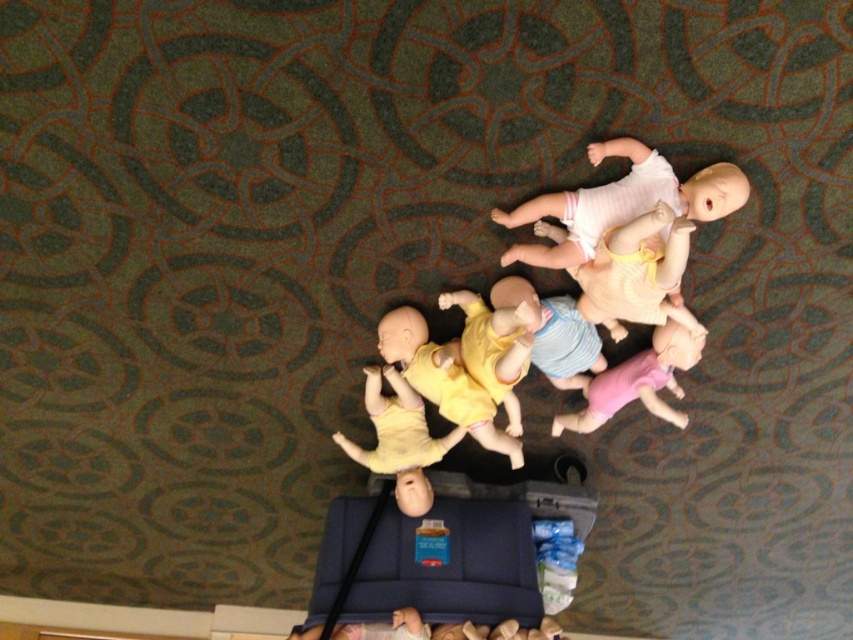
Which is more to the left, matte yellow doll at center or yellow matte baby doll at center?

From the viewer's perspective, matte yellow doll at center appears more on the left side.

Which of these two, matte yellow doll at center or yellow matte baby doll at center, stands shorter?

Standing shorter between the two is yellow matte baby doll at center.

Does point (352, 458) lie behind point (479, 317)?

Yes, point (352, 458) is behind point (479, 317).

The height and width of the screenshot is (640, 853). Identify the location of matte yellow doll at center. (399, 440).

Is white matte baby doll at upper right wider than yellow matte baby doll at center?

Correct, the width of white matte baby doll at upper right exceeds that of yellow matte baby doll at center.

Can you confirm if white matte baby doll at upper right is positioned to the left of yellow matte baby doll at center?

No, white matte baby doll at upper right is not to the left of yellow matte baby doll at center.

Is point (711, 177) less distant than point (468, 291)?

Yes.

Locate an element on the screen. The width and height of the screenshot is (853, 640). white matte baby doll at upper right is located at coordinates (621, 202).

Does yellow matte doll at center have a greater height compared to matte yellow doll at center?

Yes.

Between yellow matte doll at center and matte yellow doll at center, which one is positioned lower?

matte yellow doll at center

Is point (492, 416) positioned in front of point (421, 419)?

That is True.

Locate an element on the screen. The image size is (853, 640). yellow matte doll at center is located at coordinates click(x=445, y=381).